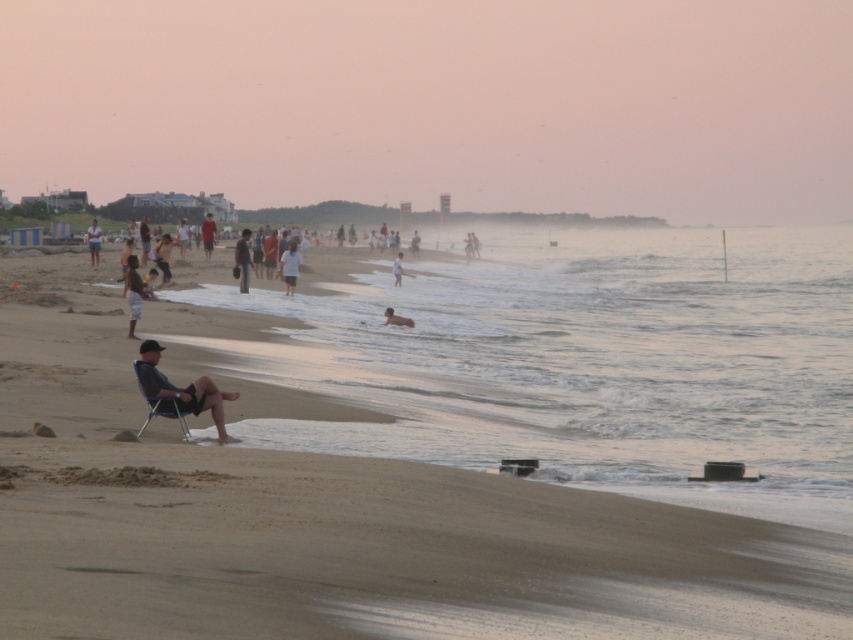
You are standing on the beach and see the dark blue fabric chair at lower left and the dark blue shirt at center. Which object is positioned to the right of the other?

The dark blue fabric chair at lower left is to the right of the dark blue shirt at center.

You are a photographer trying to capture a candid shot of the smooth skin person at center and the dark brown shorts at left. Since you want both subjects to be in focus, you need to adjust your camera settings. Considering their sizes, which subject should you focus on to ensure both are sharp?

You should focus on the dark brown shorts at left because it has a smaller size compared to the smooth skin person at center, so focusing on the closer subject will keep both in focus.